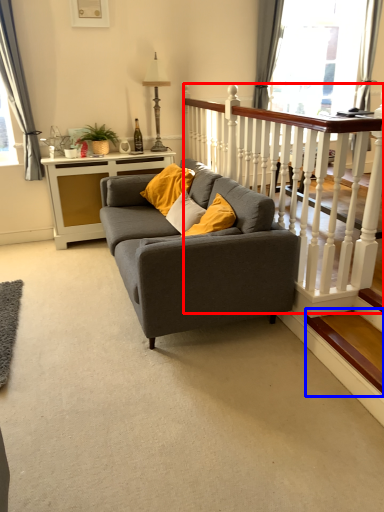
Question: Which of the following is the closest to the observer, balustrade (highlighted by a red box) or stairwell (highlighted by a blue box)?

Choices:
 (A) balustrade
 (B) stairwell

Answer: (B)